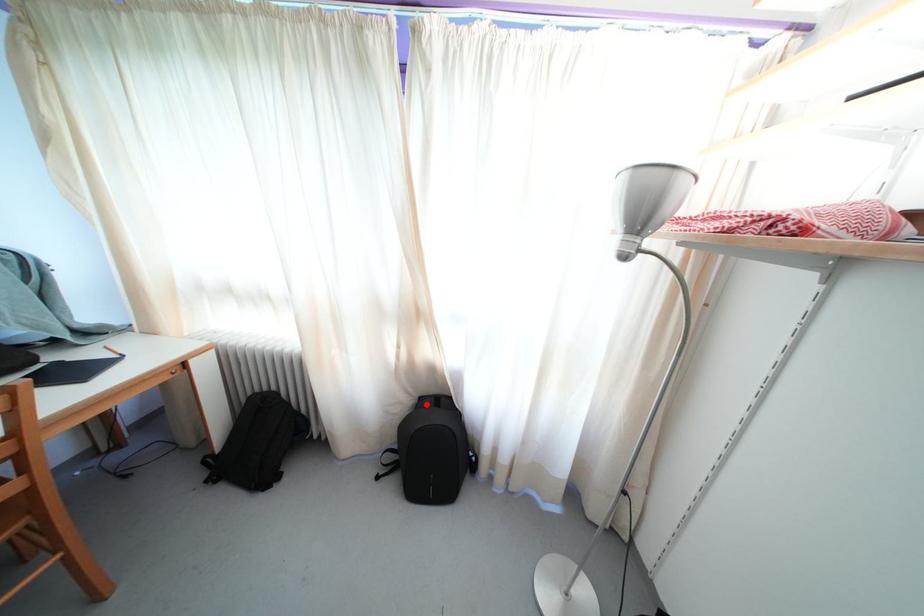
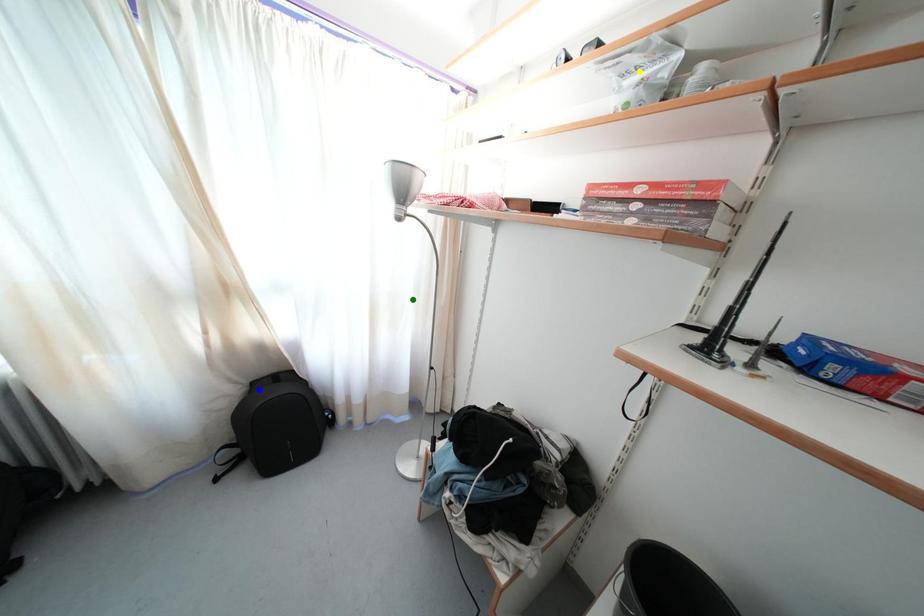
Question: I am providing you with two images of the same scene from different viewpoints. A red point is marked on the first image. You are given multiple points on the second image. Which spot in image 2 lines up with the point in image 1?

Choices:
 (A) blue point
 (B) yellow point
 (C) green point

Answer: (A)